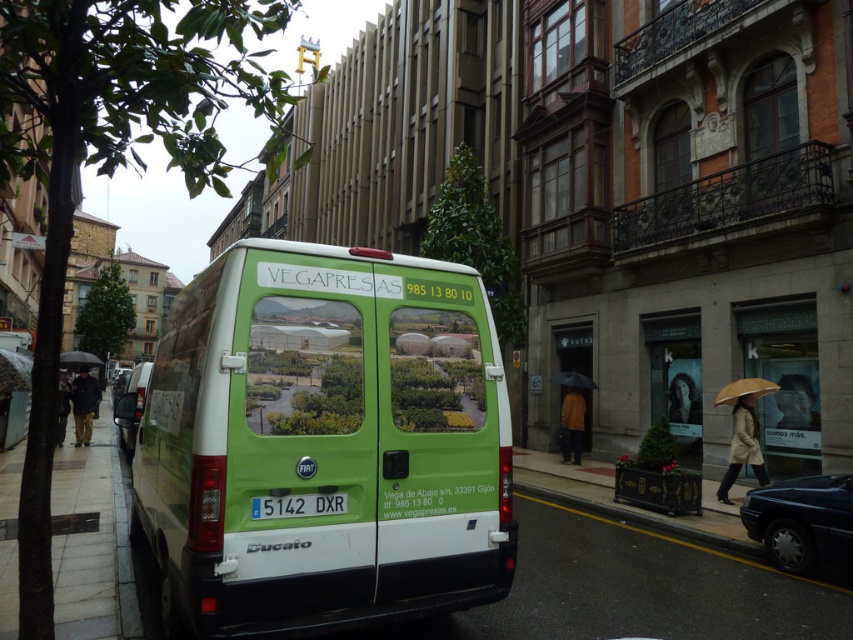
Is smooth concrete curb at lower center above dark brown leather jacket at lower left?

Incorrect, smooth concrete curb at lower center is not positioned above dark brown leather jacket at lower left.

Find the location of `smooth concrete curb at lower center`. smooth concrete curb at lower center is located at coordinates (639, 513).

Who is more forward, [531,486] or [96,403]?

Point [531,486]

At what (x,y) coordinates should I click in order to perform the action: click on smooth concrete curb at lower center. Please return your answer as a coordinate pair (x, y). This screenshot has height=640, width=853. Looking at the image, I should click on (639, 513).

Does beige fabric coat at lower right have a greater height compared to brown leather jacket at center?

Yes, beige fabric coat at lower right is taller than brown leather jacket at center.

Is point (751, 400) farther from viewer compared to point (583, 422)?

No, it is not.

What do you see at coordinates (743, 445) in the screenshot?
I see `beige fabric coat at lower right` at bounding box center [743, 445].

You are a GUI agent. You are given a task and a screenshot of the screen. Output one action in this format:
    pyautogui.click(x=<x>, y=<y>)
    Task: Click on the beige fabric coat at lower right
    This screenshot has height=640, width=853.
    Given the screenshot: What is the action you would take?
    pyautogui.click(x=743, y=445)

Measure the distance from shiny dark blue sedan at lower right to black matte umbrella at center.

The distance of shiny dark blue sedan at lower right from black matte umbrella at center is 7.82 meters.

Between point (791, 541) and point (593, 384), which one is positioned in front?

Point (791, 541) is more forward.

Measure the distance between shiny dark blue sedan at lower right and camera.

shiny dark blue sedan at lower right and camera are 6.24 meters apart.

Where is `shiny dark blue sedan at lower right`? The image size is (853, 640). shiny dark blue sedan at lower right is located at coordinates (804, 524).